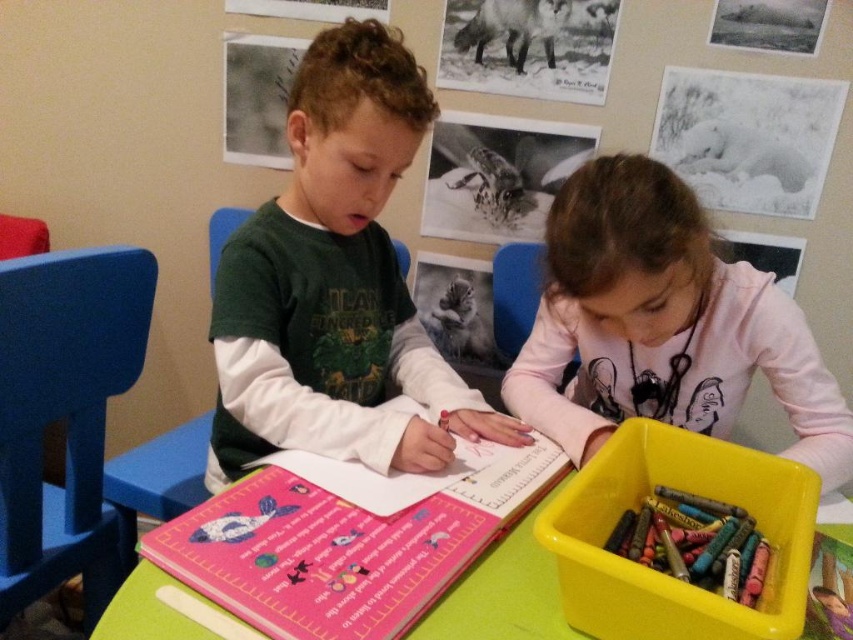
Question: Which point is farther to the camera?

Choices:
 (A) green matte shirt at center
 (B) pink matte book at center
 (C) pink cotton shirt at center

Answer: (A)

Question: Which point is farther from the camera taking this photo?

Choices:
 (A) (361, 259)
 (B) (563, 280)
 (C) (712, 579)

Answer: (A)

Question: In this image, where is green matte shirt at center located relative to pink cotton shirt at center?

Choices:
 (A) above
 (B) below

Answer: (A)

Question: Which point is closer to the camera taking this photo?

Choices:
 (A) (234, 424)
 (B) (503, 512)

Answer: (B)

Question: Can you confirm if pink matte book at center is positioned above matte plastic crayons at lower right?

Choices:
 (A) yes
 (B) no

Answer: (A)

Question: Can you confirm if pink matte book at center is bigger than matte plastic crayons at lower right?

Choices:
 (A) no
 (B) yes

Answer: (B)